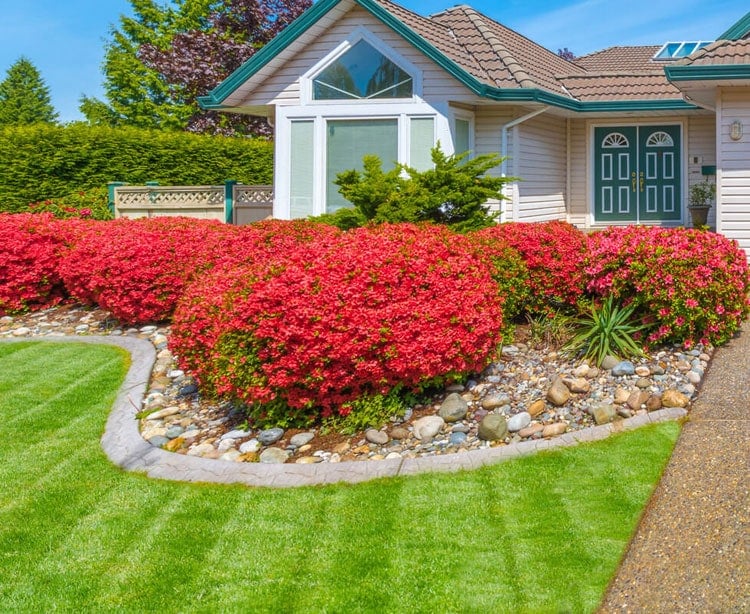
You are a GUI agent. You are given a task and a screenshot of the screen. Output one action in this format:
    pyautogui.click(x=<x>, y=<y>)
    Task: Click on the light
    This screenshot has width=750, height=614.
    Given the screenshot: What is the action you would take?
    pyautogui.click(x=733, y=131)